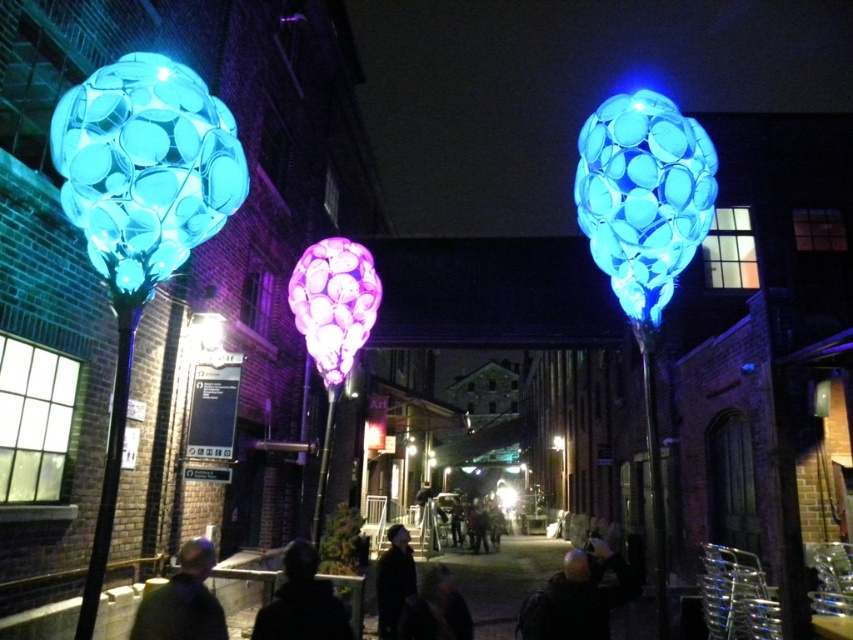
Can you confirm if dark hair at lower center is positioned above black matte jacket at lower center?

Incorrect, dark hair at lower center is not positioned above black matte jacket at lower center.

Is dark hair at lower center bigger than black matte jacket at lower center?

Yes, dark hair at lower center is bigger than black matte jacket at lower center.

Is point (604, 628) closer to viewer compared to point (314, 625)?

No, it is not.

Find the location of a particular element. dark hair at lower center is located at coordinates (577, 596).

Between dark hair at lower center and dark green fabric jacket at lower left, which one is positioned higher?

dark green fabric jacket at lower left is above.

Which of these two, dark hair at lower center or dark green fabric jacket at lower left, stands shorter?

dark green fabric jacket at lower left

Locate an element on the screen. dark hair at lower center is located at coordinates [x=577, y=596].

Is black matte jacket at lower center thinner than dark hair at center?

Yes.

Does black matte jacket at lower center have a larger size compared to dark hair at center?

No, black matte jacket at lower center is not bigger than dark hair at center.

What do you see at coordinates (302, 602) in the screenshot? The width and height of the screenshot is (853, 640). I see `black matte jacket at lower center` at bounding box center [302, 602].

Locate an element on the screen. black matte jacket at lower center is located at coordinates (302, 602).